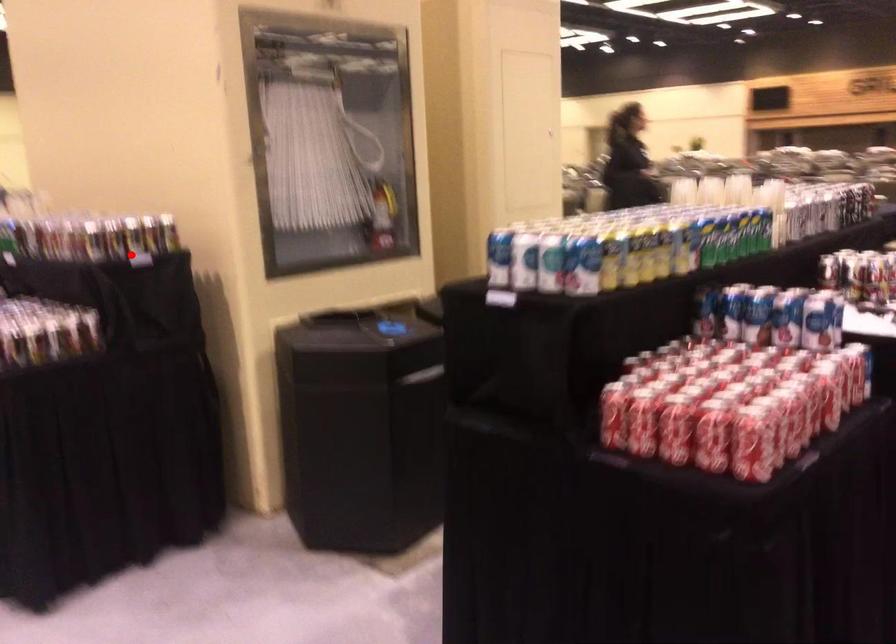
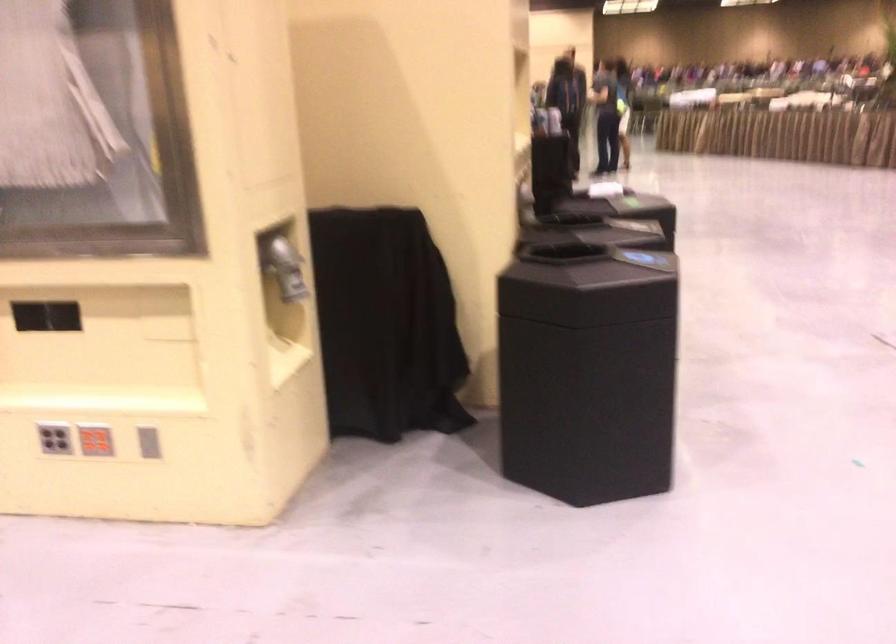
Question: I am providing you with two images of the same scene from different viewpoints. A red point is marked on the first image. Is the red point's position out of view in image 2?

Choices:
 (A) Yes
 (B) No

Answer: (A)